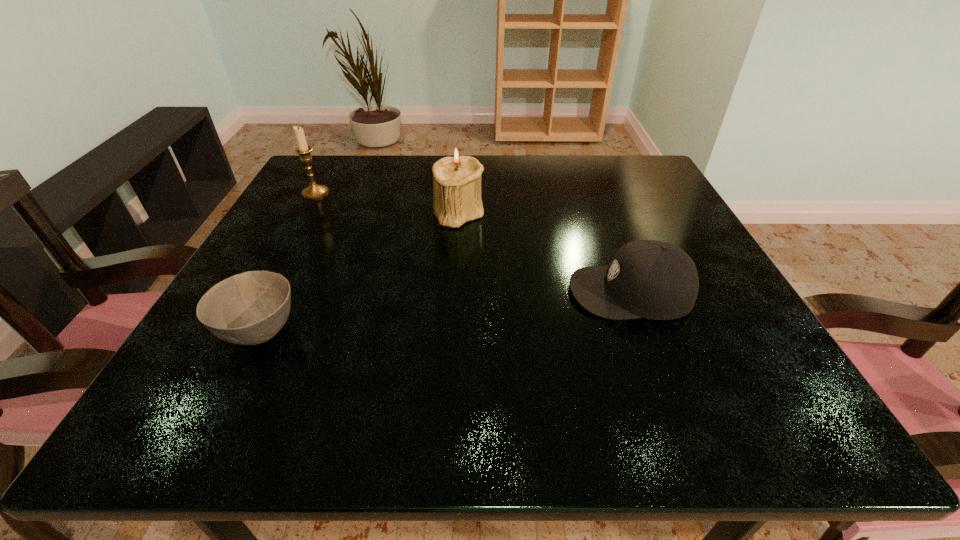
Where is `free region located on the right of the shortest object`? The height and width of the screenshot is (540, 960). free region located on the right of the shortest object is located at coordinates (388, 332).

You are a GUI agent. You are given a task and a screenshot of the screen. Output one action in this format:
    pyautogui.click(x=<x>, y=<y>)
    Task: Click on the candle holder that is at the left edge
    Image resolution: width=960 pixels, height=540 pixels.
    Given the screenshot: What is the action you would take?
    pyautogui.click(x=314, y=191)

You are a GUI agent. You are given a task and a screenshot of the screen. Output one action in this format:
    pyautogui.click(x=<x>, y=<y>)
    Task: Click on the bowl that is positioned at the left edge
    
    Given the screenshot: What is the action you would take?
    pyautogui.click(x=250, y=308)

Find the location of a particular element. The image size is (960, 540). object positioned at the right edge is located at coordinates (651, 279).

This screenshot has height=540, width=960. I want to click on object present at the far left corner, so click(x=314, y=191).

In the image, there is a desktop. Identify the location of free space at the far edge. The width and height of the screenshot is (960, 540). (557, 167).

Image resolution: width=960 pixels, height=540 pixels. Find the location of `free space at the near edge`. free space at the near edge is located at coordinates (361, 405).

In the image, there is a desktop. Where is `free space at the right edge`? The image size is (960, 540). free space at the right edge is located at coordinates (693, 357).

The image size is (960, 540). In the image, there is a desktop. Find the location of `vacant space at the far left corner`. vacant space at the far left corner is located at coordinates (287, 200).

Image resolution: width=960 pixels, height=540 pixels. I want to click on blank space at the near left corner of the desktop, so click(x=244, y=426).